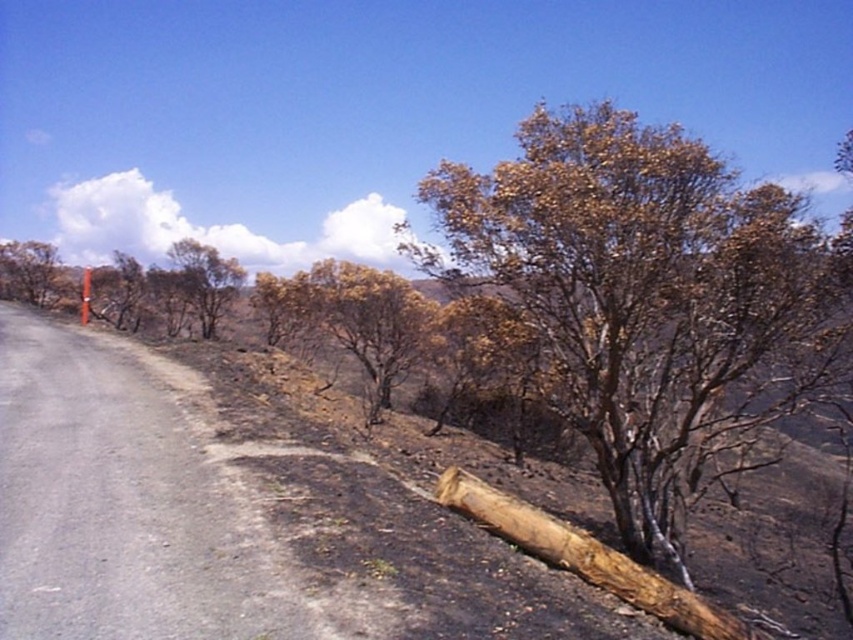
Question: Does brown/dried bark tree at right appear under brown rough wood at lower right?

Choices:
 (A) no
 (B) yes

Answer: (A)

Question: Which of the following is the farthest from the observer?

Choices:
 (A) gray asphalt road at left
 (B) brown/dried bark tree at right
 (C) burnt brown tree at left

Answer: (C)

Question: Is brown dry wood at upper left wider than burnt brown tree at left?

Choices:
 (A) yes
 (B) no

Answer: (B)

Question: Based on their relative distances, which object is farther from the brown dry wood at center?

Choices:
 (A) brown/dried bark tree at right
 (B) gray asphalt road at left
 (C) burnt brown tree at left

Answer: (C)

Question: Does gray asphalt road at left come in front of burnt brown tree at left?

Choices:
 (A) no
 (B) yes

Answer: (B)

Question: Which point is farther from the camera taking this photo?

Choices:
 (A) (479, 506)
 (B) (146, 376)
 (C) (12, 244)
 (D) (212, 282)

Answer: (C)